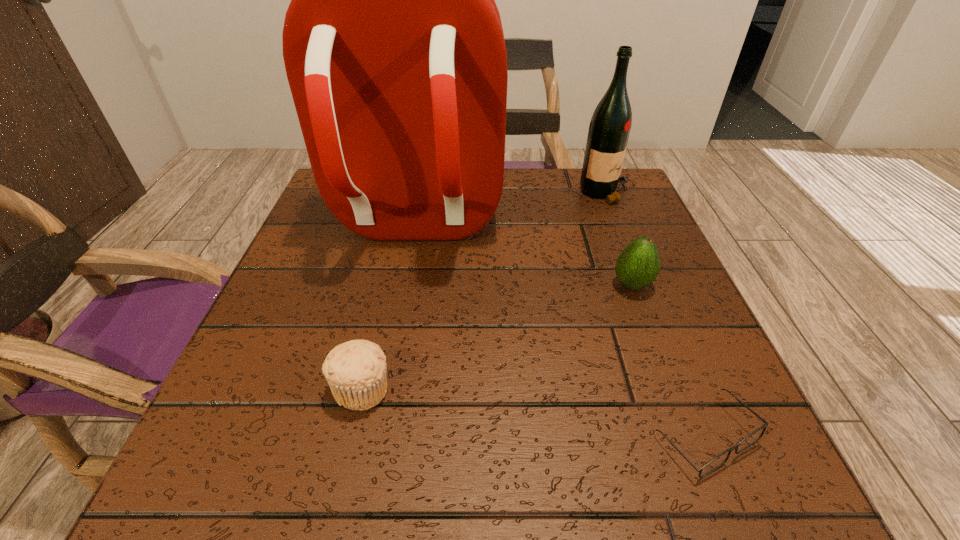
In order to click on free area in between the spectacles and the tallest object in this screenshot , I will do `click(560, 331)`.

Where is `empty space between the third shortest object and the backpack`? This screenshot has width=960, height=540. empty space between the third shortest object and the backpack is located at coordinates (523, 255).

Find the location of a particular element. The width and height of the screenshot is (960, 540). unoccupied position between the wine bottle and the avocado is located at coordinates coord(619,239).

Locate an element on the screen. Image resolution: width=960 pixels, height=540 pixels. blank region between the backpack and the fourth shortest object is located at coordinates (511, 209).

This screenshot has width=960, height=540. Identify the location of free space that is in between the muffin and the avocado. (496, 337).

Locate an element on the screen. vacant point located between the shortest object and the backpack is located at coordinates (560, 331).

Locate which object ranks fourth in proximity to the avocado. Please provide its 2D coordinates. Your answer should be formatted as a tuple, i.e. [(x, y)], where the tuple contains the x and y coordinates of a point satisfying the conditions above.

[(355, 370)]

At what (x,y) coordinates should I click in order to perform the action: click on object that is the third closest one to the backpack. Please return your answer as a coordinate pair (x, y). The height and width of the screenshot is (540, 960). Looking at the image, I should click on (355, 370).

At what (x,y) coordinates should I click in order to perform the action: click on vacant space that satisfies the following two spatial constraints: 1. on the strap side of the backpack; 2. on the left side of the avocado. Please return your answer as a coordinate pair (x, y). The height and width of the screenshot is (540, 960). Looking at the image, I should click on (403, 285).

At what (x,y) coordinates should I click in order to perform the action: click on vacant region that satisfies the following two spatial constraints: 1. on the back side of the second shortest object; 2. on the right side of the avocado. Please return your answer as a coordinate pair (x, y). Looking at the image, I should click on (386, 285).